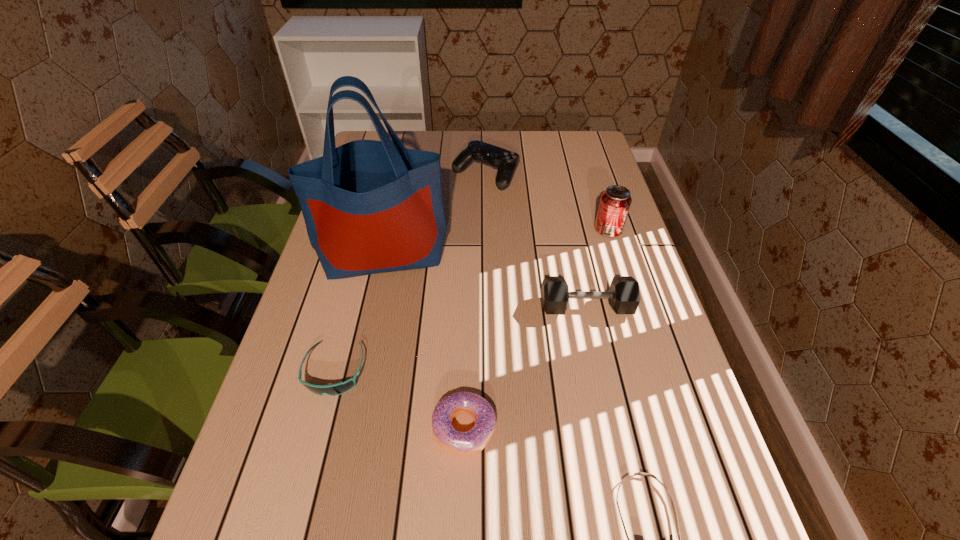
This screenshot has height=540, width=960. Find the location of `blank space at the far right corner`. blank space at the far right corner is located at coordinates (595, 145).

The image size is (960, 540). What are the coordinates of `free point between the sixth farthest object and the control` in the screenshot? It's located at (475, 301).

You are a GUI agent. You are given a task and a screenshot of the screen. Output one action in this format:
    pyautogui.click(x=<x>, y=<y>)
    Task: Click on the free space between the sixth farthest object and the soda can
    
    Given the screenshot: What is the action you would take?
    pyautogui.click(x=537, y=329)

You are a GUI agent. You are given a task and a screenshot of the screen. Output one action in this format:
    pyautogui.click(x=<x>, y=<y>)
    Task: Click on the unoccupied area between the soda can and the handbag
    
    Given the screenshot: What is the action you would take?
    pyautogui.click(x=496, y=242)

Image resolution: width=960 pixels, height=540 pixels. Identify the location of free space that is in between the sixth farthest object and the tallest object. (424, 341).

Where is `free spot between the sixth shortest object and the third nearest object`? free spot between the sixth shortest object and the third nearest object is located at coordinates (471, 301).

You are a GUI agent. You are given a task and a screenshot of the screen. Output one action in this format:
    pyautogui.click(x=<x>, y=<y>)
    Task: Click on the empty space between the soda can and the dumbbell
    
    Given the screenshot: What is the action you would take?
    pyautogui.click(x=597, y=269)

At what (x,y) coordinates should I click in order to perform the action: click on blank region between the control and the doughnut. Please return your answer as a coordinate pair (x, y). The height and width of the screenshot is (540, 960). Looking at the image, I should click on (475, 301).

The image size is (960, 540). What are the coordinates of `object identified as the closest to the control` in the screenshot? It's located at (369, 206).

Point out which object is positioned as the fourth nearest to the sixth shortest object. Please provide its 2D coordinates. Your answer should be formatted as a tuple, i.e. [(x, y)], where the tuple contains the x and y coordinates of a point satisfying the conditions above.

[(470, 442)]